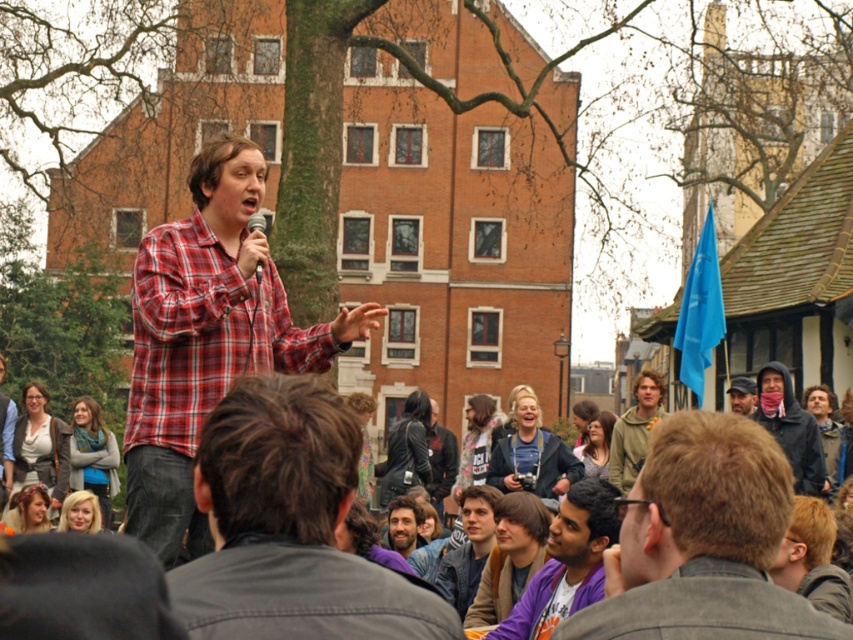
Is dark gray hoodie at center above matte black jacket at center?

No, dark gray hoodie at center is not above matte black jacket at center.

Who is positioned more to the right, dark gray hoodie at center or matte black jacket at center?

dark gray hoodie at center

Which is in front, point (769, 416) or point (595, 422)?

Point (769, 416) is more forward.

This screenshot has height=640, width=853. I want to click on dark gray hoodie at center, so click(790, 428).

Who is more distant from viewer, (814, 483) or (260, 278)?

The point (814, 483) is behind.

Does dark gray hoodie at center appear on the right side of matte black microphone at center?

Indeed, dark gray hoodie at center is positioned on the right side of matte black microphone at center.

Which is behind, point (786, 387) or point (260, 275)?

The point (786, 387) is more distant.

The image size is (853, 640). I want to click on dark gray hoodie at center, so click(x=790, y=428).

Does point (221, 353) come closer to viewer compared to point (535, 600)?

That is True.

Is red plaid shirt at center to the right of purple cotton shirt at lower center from the viewer's perspective?

No, red plaid shirt at center is not to the right of purple cotton shirt at lower center.

Where is `red plaid shirt at center`? The height and width of the screenshot is (640, 853). red plaid shirt at center is located at coordinates (207, 339).

At what (x,y) coordinates should I click in order to perform the action: click on red plaid shirt at center. Please return your answer as a coordinate pair (x, y). Looking at the image, I should click on (207, 339).